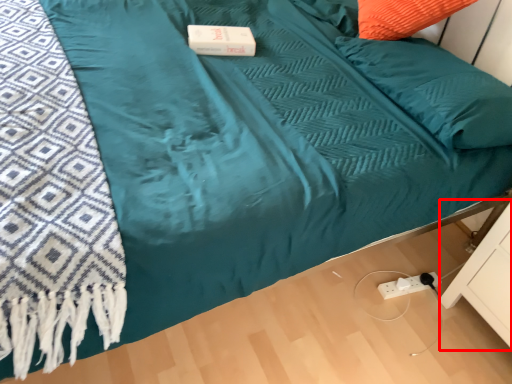
Question: Considering the relative positions of drawer (annotated by the red box) and pillow in the image provided, where is drawer (annotated by the red box) located with respect to the staircase?

Choices:
 (A) right
 (B) left

Answer: (A)